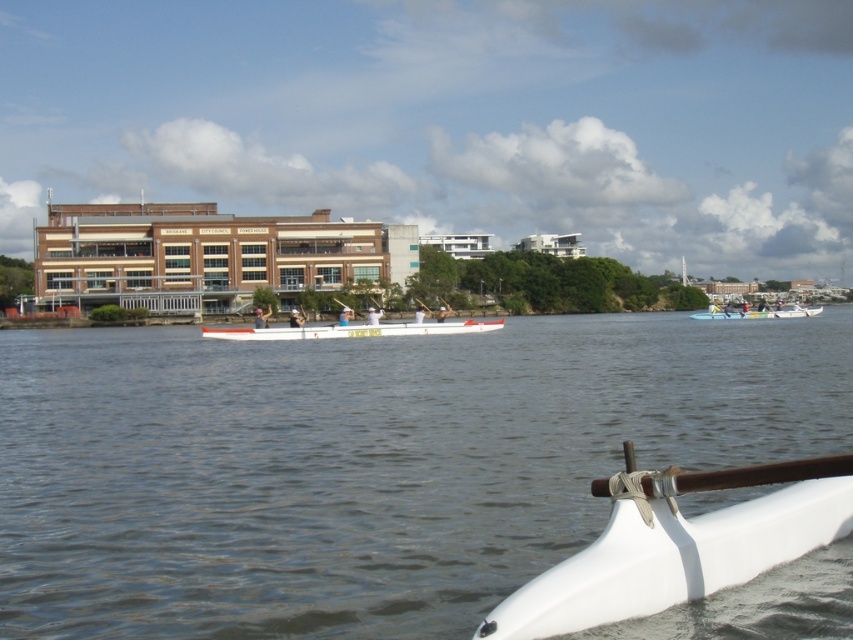
Is white matte boat at lower right in front of white glossy canoe at center?

That is True.

Which is above, white matte boat at lower right or white glossy canoe at center?

white glossy canoe at center is higher up.

Does point (619, 512) come farther from viewer compared to point (779, 312)?

No, it is in front of (779, 312).

Locate an element on the screen. white matte boat at lower right is located at coordinates (680, 547).

Between point (849, 404) and point (697, 320), which one is positioned in front?

Point (849, 404)

Which is in front, point (686, 358) or point (755, 316)?

Point (686, 358)

Find the location of `white smooth water at center`. white smooth water at center is located at coordinates (364, 464).

Does white smooth water at center have a greater height compared to white matte boat at lower right?

Correct, white smooth water at center is much taller as white matte boat at lower right.

Who is positioned more to the right, white smooth water at center or white matte boat at lower right?

From the viewer's perspective, white matte boat at lower right appears more on the right side.

Is point (786, 604) farther from viewer compared to point (511, 628)?

Yes, it is.

Where is `white smooth water at center`? white smooth water at center is located at coordinates (364, 464).